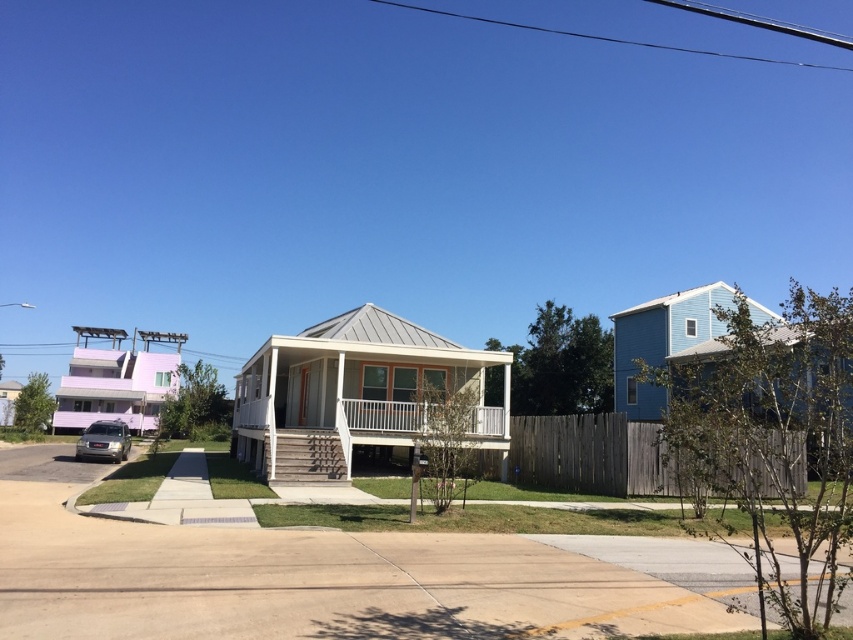
You are standing at the edge of the suburban residential area and want to know which object is shorter between the white metal porch at center and the satin silver suv at lower left. Can you tell me?

The white metal porch at center has a lesser height compared to the satin silver suv at lower left, so the white metal porch at center is shorter.